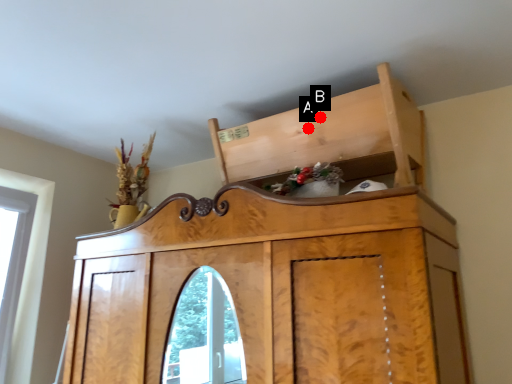
Question: Two points are circled on the image, labeled by A and B beside each circle. Which point is closer to the camera?

Choices:
 (A) A is closer
 (B) B is closer

Answer: (B)